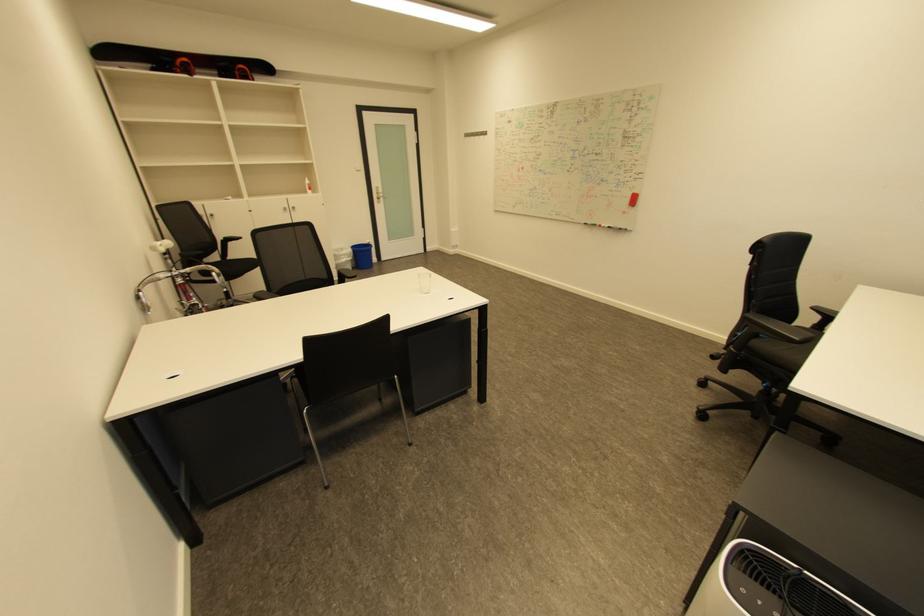
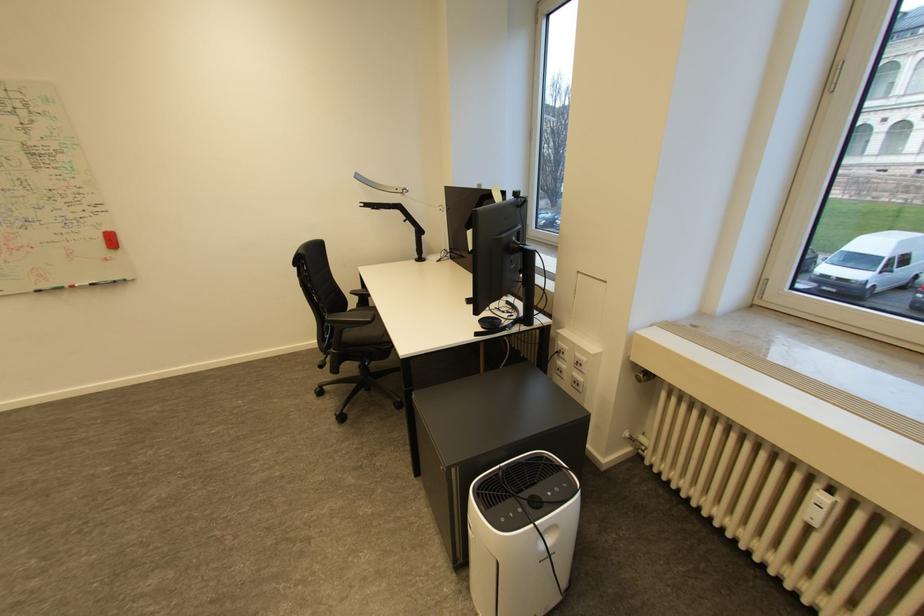
Find the pixel in the second image that matches point 638,195 in the first image.

(108, 235)